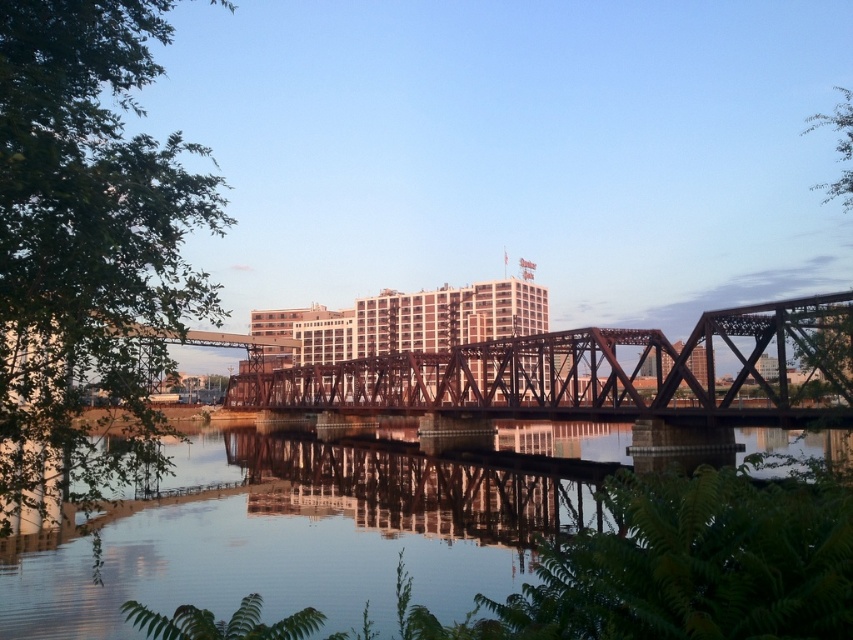
Question: Can you confirm if clear water at center is positioned above rusty metal bridge at center?

Choices:
 (A) no
 (B) yes

Answer: (A)

Question: Can you confirm if clear water at center is bigger than rusty metal bridge at center?

Choices:
 (A) yes
 (B) no

Answer: (B)

Question: Which point is farther to the camera?

Choices:
 (A) clear water at center
 (B) rusty metal bridge at center

Answer: (B)

Question: Can you confirm if clear water at center is smaller than rusty metal bridge at center?

Choices:
 (A) no
 (B) yes

Answer: (B)